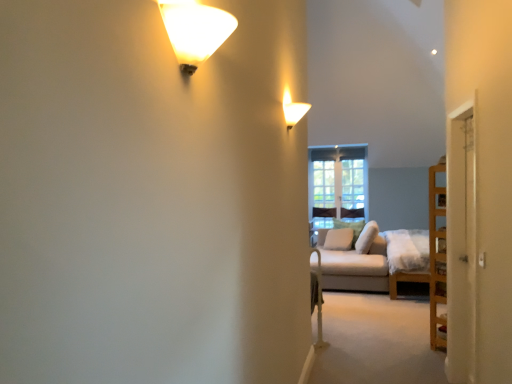
This screenshot has width=512, height=384. Find the location of `white fabric pillow at center, the first pillow positioned from the front`. white fabric pillow at center, the first pillow positioned from the front is located at coordinates (366, 237).

This screenshot has width=512, height=384. What do you see at coordinates (407, 257) in the screenshot?
I see `white fabric couch at right` at bounding box center [407, 257].

This screenshot has width=512, height=384. I want to click on matte glass lamp at upper left, which is counted as the second lamp, starting from the back, so click(x=195, y=30).

What do you see at coordinates (338, 239) in the screenshot? I see `white soft pillow at center, the 2th pillow when ordered from front to back` at bounding box center [338, 239].

Measure the distance between point (466, 165) and camera.

They are 2.45 meters apart.

Where is `white wooden door at right`? This screenshot has height=384, width=512. white wooden door at right is located at coordinates (461, 245).

What do you see at coordinates (338, 183) in the screenshot? I see `clear glass window at center` at bounding box center [338, 183].

The height and width of the screenshot is (384, 512). Find the location of `white fabric pillow at center, the first pillow positioned from the front`. white fabric pillow at center, the first pillow positioned from the front is located at coordinates (366, 237).

Who is more distant, matte glass lamp at upper left, positioned as the first lamp in left-to-right order, or clear glass window at center?

clear glass window at center is behind.

Between point (186, 25) and point (320, 147), which one is positioned in front?

Point (186, 25)

Is matte glass lamp at upper left, the 1th lamp in the front-to-back sequence, wider or thinner than clear glass window at center?

Considering their sizes, matte glass lamp at upper left, the 1th lamp in the front-to-back sequence, looks broader than clear glass window at center.

Is matte glass lamp at upper left, which is counted as the second lamp, starting from the back, aimed at clear glass window at center?

No, matte glass lamp at upper left, which is counted as the second lamp, starting from the back, is not aimed at clear glass window at center.

The width and height of the screenshot is (512, 384). I want to click on lamp that is the 1st one when counting forward from the clear glass window at center, so click(293, 109).

Looking at this image, from the image's perspective, which one is positioned higher, clear glass window at center or matte white wall sconce at upper center, placed as the first lamp when sorted from back to front?

From the image's view, matte white wall sconce at upper center, placed as the first lamp when sorted from back to front, is above.

Considering the relative sizes of clear glass window at center and matte white wall sconce at upper center, positioned as the first lamp in right-to-left order, in the image provided, is clear glass window at center thinner than matte white wall sconce at upper center, positioned as the first lamp in right-to-left order,?

Yes, clear glass window at center is thinner than matte white wall sconce at upper center, positioned as the first lamp in right-to-left order.

Is clear glass window at center smaller than matte white wall sconce at upper center, which is counted as the second lamp, starting from the front?

Incorrect, clear glass window at center is not smaller in size than matte white wall sconce at upper center, which is counted as the second lamp, starting from the front.

What's the angular difference between clear glass window at center and white fabric pillow at center, which is counted as the third pillow, starting from the back,'s facing directions?

The angle between the facing direction of clear glass window at center and the facing direction of white fabric pillow at center, which is counted as the third pillow, starting from the back, is 90 degrees.

Is the depth of clear glass window at center greater than that of white fabric pillow at center, which is counted as the third pillow, starting from the back?

Yes, it is.

Does point (345, 148) come behind point (362, 230)?

Yes, it is behind point (362, 230).

Can you confirm if clear glass window at center is taller than white fabric pillow at center, the first pillow positioned from the front?

Yes.

Considering the relative sizes of white soft pillow at center, the first pillow viewed from the back, and matte glass lamp at upper left, the 2th lamp when ordered from right to left, in the image provided, is white soft pillow at center, the first pillow viewed from the back, wider than matte glass lamp at upper left, the 2th lamp when ordered from right to left,?

Yes, white soft pillow at center, the first pillow viewed from the back, is wider than matte glass lamp at upper left, the 2th lamp when ordered from right to left.

Is white soft pillow at center, the first pillow viewed from the back, outside of matte glass lamp at upper left, the 2th lamp when ordered from right to left?

Yes, white soft pillow at center, the first pillow viewed from the back, is outside of matte glass lamp at upper left, the 2th lamp when ordered from right to left.

How many degrees apart are the facing directions of white soft pillow at center, marked as the third pillow in a front-to-back arrangement, and matte glass lamp at upper left, the 1th lamp in the front-to-back sequence?

The angle between the facing direction of white soft pillow at center, marked as the third pillow in a front-to-back arrangement, and the facing direction of matte glass lamp at upper left, the 1th lamp in the front-to-back sequence, is 103 degrees.

Is the depth of white soft pillow at center, the first pillow viewed from the back, less than that of matte glass lamp at upper left, which is counted as the second lamp, starting from the back?

No, the depth of white soft pillow at center, the first pillow viewed from the back, is greater than that of matte glass lamp at upper left, which is counted as the second lamp, starting from the back.

Which is closer to the camera, (473, 341) or (369, 241)?

Point (473, 341).

Considering the positions of objects white wooden door at right and white fabric pillow at center, the first pillow positioned from the front, in the image provided, who is in front, white wooden door at right or white fabric pillow at center, the first pillow positioned from the front,?

Positioned in front is white wooden door at right.

Does white wooden door at right touch white fabric pillow at center, which is counted as the third pillow, starting from the back?

No, white wooden door at right is not with white fabric pillow at center, which is counted as the third pillow, starting from the back.

From the image's perspective, starting from the white soft pillow at center, marked as the third pillow in a front-to-back arrangement, which lamp is the 1st one above? Please provide its 2D coordinates.

[(195, 30)]

From a real-world perspective, is matte glass lamp at upper left, which is counted as the second lamp, starting from the back, under white soft pillow at center, the first pillow viewed from the back?

No, from a real-world perspective, matte glass lamp at upper left, which is counted as the second lamp, starting from the back, is not under white soft pillow at center, the first pillow viewed from the back.

Is matte glass lamp at upper left, the 2th lamp when ordered from right to left, looking in the opposite direction of white soft pillow at center, the first pillow viewed from the back?

No, matte glass lamp at upper left, the 2th lamp when ordered from right to left, is not facing the opposite direction of white soft pillow at center, the first pillow viewed from the back.

Is the surface of matte glass lamp at upper left, the 2th lamp when ordered from right to left, in direct contact with white soft pillow at center, the first pillow viewed from the back?

matte glass lamp at upper left, the 2th lamp when ordered from right to left, is not next to white soft pillow at center, the first pillow viewed from the back, and they're not touching.

Is clear glass window at center thinner than white soft pillow at center, marked as the third pillow in a front-to-back arrangement?

Indeed, clear glass window at center has a lesser width compared to white soft pillow at center, marked as the third pillow in a front-to-back arrangement.

Considering the positions of objects clear glass window at center and white soft pillow at center, the first pillow viewed from the back, in the image provided, who is in front, clear glass window at center or white soft pillow at center, the first pillow viewed from the back,?

Positioned in front is white soft pillow at center, the first pillow viewed from the back.

From a real-world perspective, between clear glass window at center and white soft pillow at center, the first pillow viewed from the back, who is vertically lower?

From a 3D spatial view, white soft pillow at center, the first pillow viewed from the back, is below.

Considering the positions of objects clear glass window at center and white soft pillow at center, the first pillow viewed from the back, in the image provided, who is more to the left, clear glass window at center or white soft pillow at center, the first pillow viewed from the back,?

white soft pillow at center, the first pillow viewed from the back, is more to the left.

The height and width of the screenshot is (384, 512). What are the coordinates of `window located on the right of matte glass lamp at upper left, positioned as the first lamp in left-to-right order` in the screenshot? It's located at (338, 183).

You are a GUI agent. You are given a task and a screenshot of the screen. Output one action in this format:
    pyautogui.click(x=<x>, y=<y>)
    Task: Click on the 1st lamp in front when counting from the clear glass window at center
    
    Given the screenshot: What is the action you would take?
    293,109

Estimate the real-world distances between objects in this image. Which object is further from clear glass window at center, white fabric couch at right or white soft pillow at center, positioned as the second pillow in back-to-front order?

white fabric couch at right is further to clear glass window at center.

From the image, which object appears to be farther from white fabric pillow at center, which is counted as the third pillow, starting from the back, matte glass lamp at upper left, which is counted as the second lamp, starting from the back, or white wooden door at right?

matte glass lamp at upper left, which is counted as the second lamp, starting from the back, lies further to white fabric pillow at center, which is counted as the third pillow, starting from the back, than the other object.

Based on their spatial positions, is white fabric couch at right or white fabric pillow at center, which is counted as the third pillow, starting from the back, closer to matte white wall sconce at upper center, placed as the 2th lamp when sorted from left to right?

white fabric couch at right lies closer to matte white wall sconce at upper center, placed as the 2th lamp when sorted from left to right, than the other object.

From the image, which object appears to be farther from clear glass window at center, matte white wall sconce at upper center, which is counted as the second lamp, starting from the front, or white soft pillow at center, positioned as the second pillow in back-to-front order?

matte white wall sconce at upper center, which is counted as the second lamp, starting from the front.

When comparing their distances from white wooden door at right, does white soft pillow at center, marked as the third pillow in a front-to-back arrangement, or white fabric pillow at center, which is counted as the third pillow, starting from the back, seem further?

Among the two, white soft pillow at center, marked as the third pillow in a front-to-back arrangement, is located further to white wooden door at right.

From the image, which object appears to be farther from matte white wall sconce at upper center, placed as the first lamp when sorted from back to front, matte glass lamp at upper left, the 1th lamp in the front-to-back sequence, or white fabric pillow at center, which is counted as the third pillow, starting from the back?

Among the two, white fabric pillow at center, which is counted as the third pillow, starting from the back, is located further to matte white wall sconce at upper center, placed as the first lamp when sorted from back to front.

Considering their positions, is white wooden door at right positioned further to matte glass lamp at upper left, the 1th lamp in the front-to-back sequence, than white soft pillow at center, marked as the third pillow in a front-to-back arrangement?

white soft pillow at center, marked as the third pillow in a front-to-back arrangement, is further to matte glass lamp at upper left, the 1th lamp in the front-to-back sequence.

In the scene shown: Estimate the real-world distances between objects in this image. Which object is closer to white fabric couch at right, white soft pillow at center, the first pillow viewed from the back, or white fabric pillow at center, which is counted as the third pillow, starting from the back?

The object closer to white fabric couch at right is white fabric pillow at center, which is counted as the third pillow, starting from the back.

Where is `couch between matte glass lamp at upper left, the 2th lamp when ordered from right to left, and white soft pillow at center, the 2th pillow when ordered from front to back, along the z-axis`? couch between matte glass lamp at upper left, the 2th lamp when ordered from right to left, and white soft pillow at center, the 2th pillow when ordered from front to back, along the z-axis is located at coordinates (407, 257).

Identify the location of lamp positioned between white wooden door at right and white soft pillow at center, marked as the third pillow in a front-to-back arrangement, from near to far. This screenshot has width=512, height=384. (293, 109).

You are a GUI agent. You are given a task and a screenshot of the screen. Output one action in this format:
    pyautogui.click(x=<x>, y=<y>)
    Task: Click on the couch between matte white wall sconce at upper center, placed as the first lamp when sorted from back to front, and white soft pillow at center, the first pillow viewed from the back, from front to back
    This screenshot has width=512, height=384.
    Given the screenshot: What is the action you would take?
    pyautogui.click(x=407, y=257)

I want to click on lamp between white wooden door at right and white fabric pillow at center, the first pillow positioned from the front, from front to back, so click(x=293, y=109).